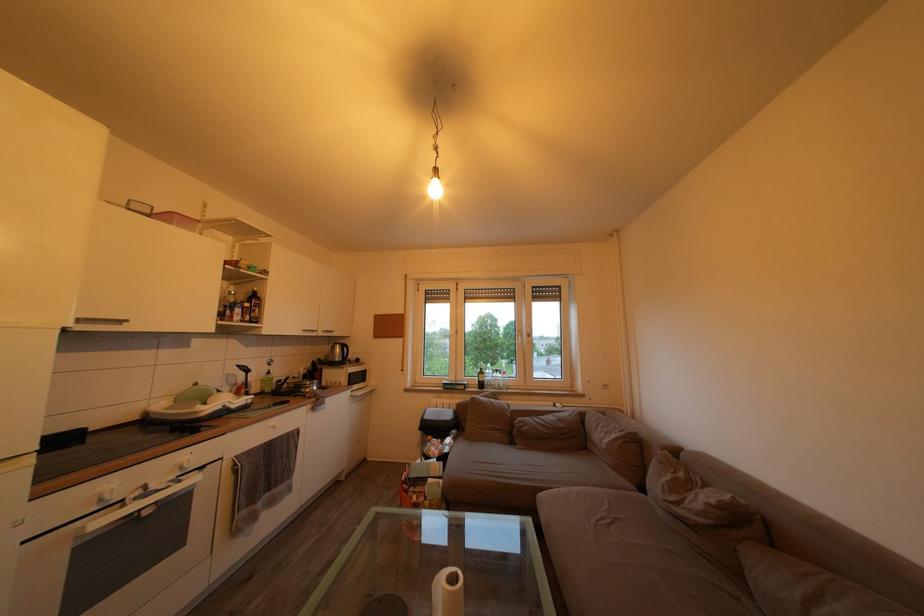
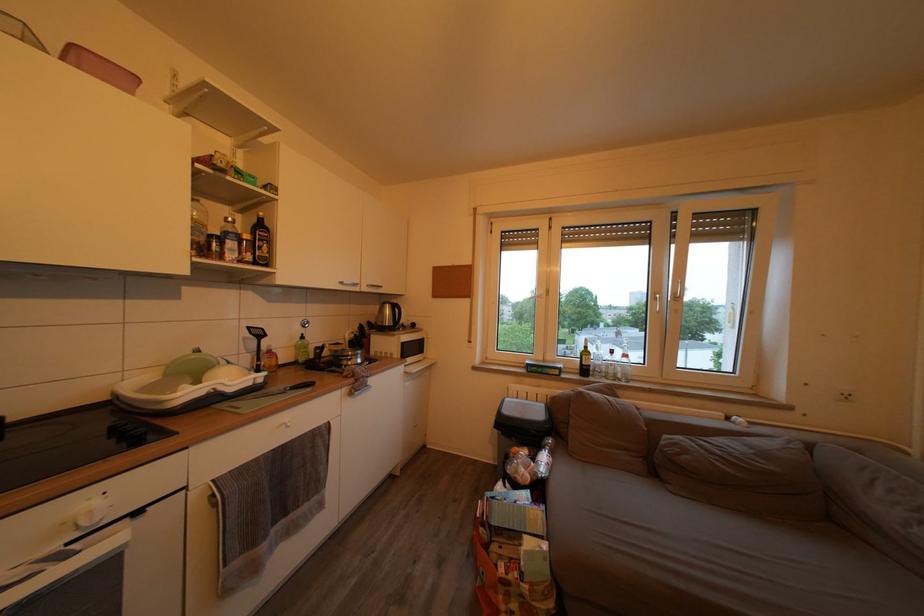
Locate, in the second image, the point that corresponds to (254,310) in the first image.

(253, 243)